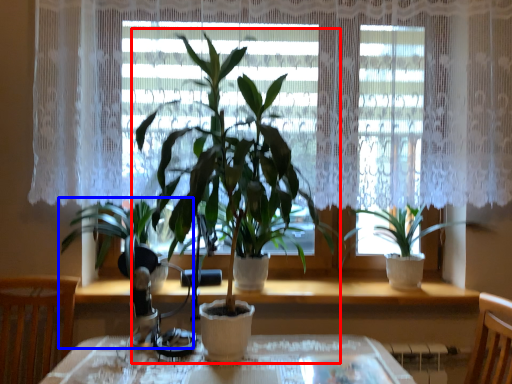
Question: Among these objects, which one is nearest to the camera, houseplant (highlighted by a red box) or houseplant (highlighted by a blue box)?

Choices:
 (A) houseplant
 (B) houseplant

Answer: (A)